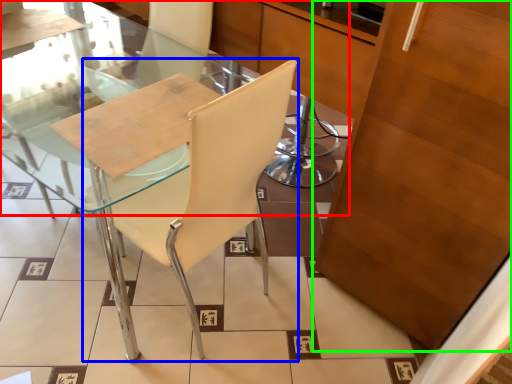
Question: Which object is positioned farthest from glass table (highlighted by a red box)? Select from chair (highlighted by a blue box) and cabinetry (highlighted by a green box).

Choices:
 (A) chair
 (B) cabinetry

Answer: (B)